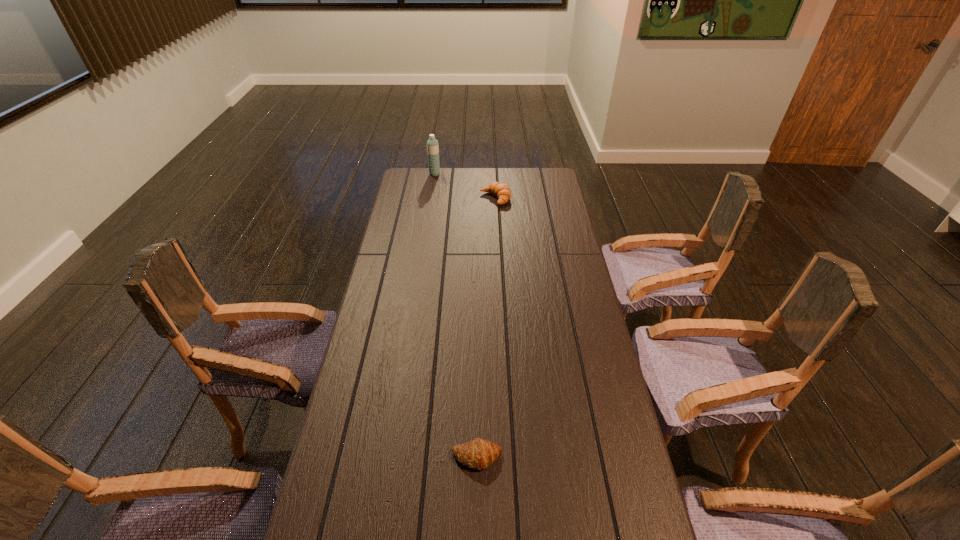
You are a GUI agent. You are given a task and a screenshot of the screen. Output one action in this format:
    pyautogui.click(x=<x>, y=<y>)
    Task: Click on the vacant point located between the second shortest object and the nearest object
    The image size is (960, 540).
    Given the screenshot: What is the action you would take?
    point(486,328)

I want to click on vacant point located between the taller crescent roll and the shorter crescent roll, so tap(486, 328).

Find the location of a particular element. The height and width of the screenshot is (540, 960). vacant space in between the farthest object and the nearer crescent roll is located at coordinates (x=456, y=315).

Identify which object is located as the second nearest to the second farthest object. Please provide its 2D coordinates. Your answer should be formatted as a tuple, i.e. [(x, y)], where the tuple contains the x and y coordinates of a point satisfying the conditions above.

[(479, 453)]

Find the location of a particular element. Image resolution: width=960 pixels, height=540 pixels. object that ranks as the closest to the shorter crescent roll is located at coordinates (502, 191).

Locate which crescent roll ranks in proximity to the tallest object. Please provide its 2D coordinates. Your answer should be formatted as a tuple, i.e. [(x, y)], where the tuple contains the x and y coordinates of a point satisfying the conditions above.

[(502, 191)]

Locate an element on the screen. Image resolution: width=960 pixels, height=540 pixels. crescent roll that is the closest to the water bottle is located at coordinates (502, 191).

Where is `free space in the image that satisfies the following two spatial constraints: 1. on the front side of the nearer crescent roll; 2. on the right side of the farthest object`? free space in the image that satisfies the following two spatial constraints: 1. on the front side of the nearer crescent roll; 2. on the right side of the farthest object is located at coordinates (391, 457).